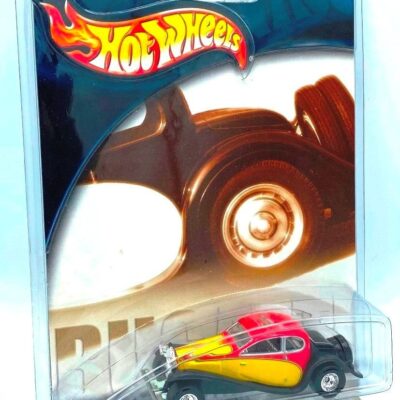
Locate an element on the screen. This screenshot has height=400, width=400. dark blue decorative stripe is located at coordinates (80, 109), (307, 32), (108, 7).